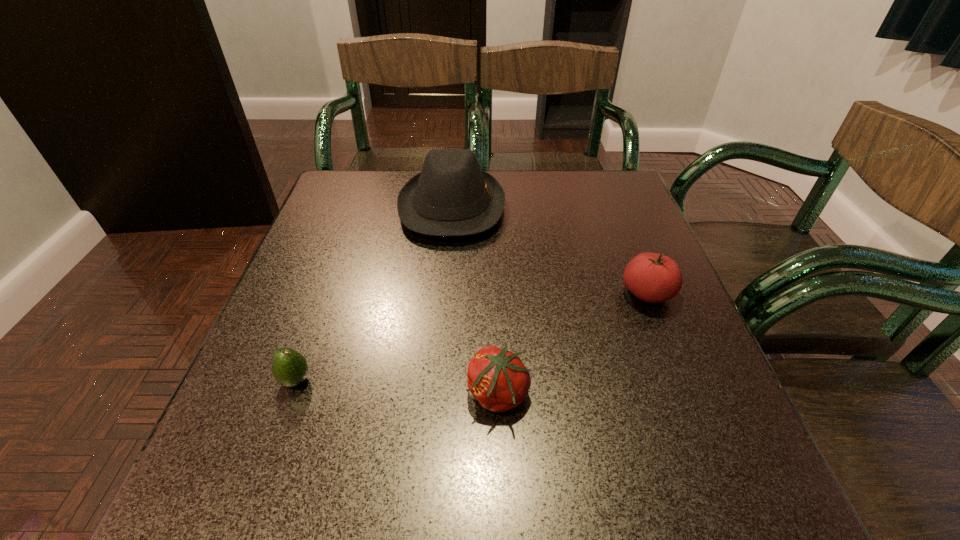
Find the location of a particular element. The image size is (960, 540). free location located on the left of the leftmost object is located at coordinates (251, 380).

The width and height of the screenshot is (960, 540). Find the location of `object that is positioned at the far edge`. object that is positioned at the far edge is located at coordinates (451, 196).

Identify the location of object at the left edge. The width and height of the screenshot is (960, 540). (289, 367).

Image resolution: width=960 pixels, height=540 pixels. In order to click on object that is positioned at the right edge in this screenshot , I will do `click(651, 277)`.

This screenshot has height=540, width=960. I want to click on vacant space at the far edge, so click(509, 179).

Image resolution: width=960 pixels, height=540 pixels. In order to click on free space at the near edge of the desktop in this screenshot , I will do `click(443, 497)`.

The image size is (960, 540). In the image, there is a desktop. Identify the location of vacant space at the left edge. (279, 309).

Locate an element on the screen. The width and height of the screenshot is (960, 540). blank area at the right edge is located at coordinates (648, 338).

You are a GUI agent. You are given a task and a screenshot of the screen. Output one action in this format:
    pyautogui.click(x=<x>, y=<y>)
    Task: Click on the vacant space at the far left corner of the desktop
    
    Given the screenshot: What is the action you would take?
    pyautogui.click(x=344, y=180)

Identify the location of vacant space at the far right corner of the desktop. (620, 215).